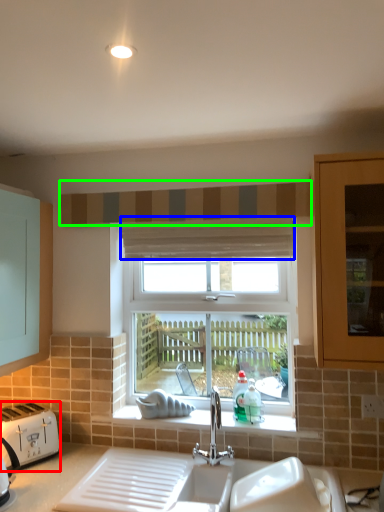
Question: Which object is positioned farthest from toaster (highlighted by a red box)? Select from curtain (highlighted by a blue box) and curtain (highlighted by a green box).

Choices:
 (A) curtain
 (B) curtain

Answer: (B)